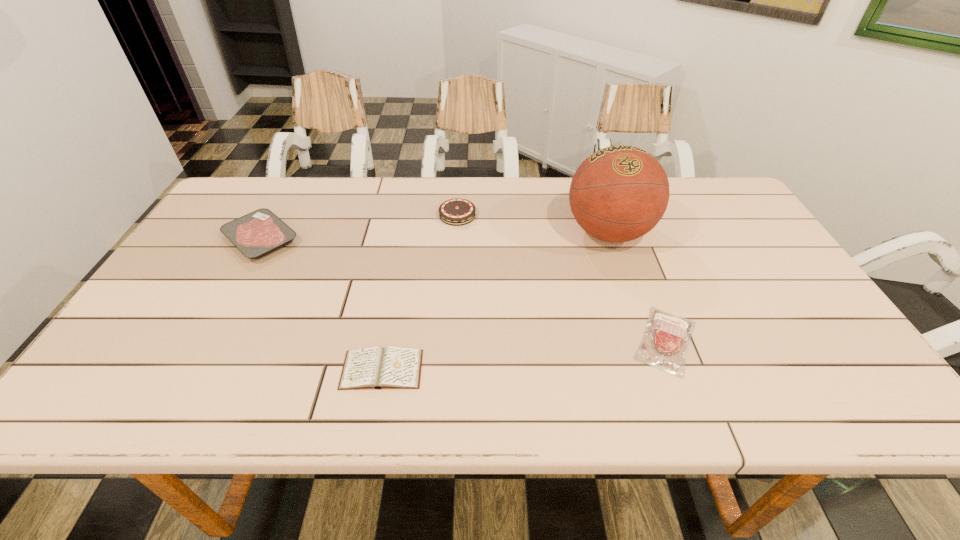
In order to click on vacant point located between the chocolate cake and the taller steak in this screenshot , I will do `click(359, 227)`.

The width and height of the screenshot is (960, 540). I want to click on blank region between the basketball and the shorter steak, so click(637, 286).

Identify the location of free spot between the second tallest object and the leftmost object. The image size is (960, 540). [x=359, y=227].

This screenshot has width=960, height=540. I want to click on vacant area that lies between the tallest object and the fourth shortest object, so click(x=533, y=224).

Locate which object ranks fourth in proximity to the nearer steak. Please provide its 2D coordinates. Your answer should be formatted as a tuple, i.e. [(x, y)], where the tuple contains the x and y coordinates of a point satisfying the conditions above.

[(256, 234)]

Identify the location of the third closest object to the shorter steak. (375, 367).

Find the location of a particular element. Image resolution: width=960 pixels, height=540 pixels. vacant region that satisfies the following two spatial constraints: 1. on the front side of the nearer steak; 2. on the left side of the fourth shortest object is located at coordinates (449, 340).

The image size is (960, 540). In order to click on vacant space that satisfies the following two spatial constraints: 1. on the back side of the chocolate cake; 2. on the right side of the left steak in this screenshot , I will do `click(275, 215)`.